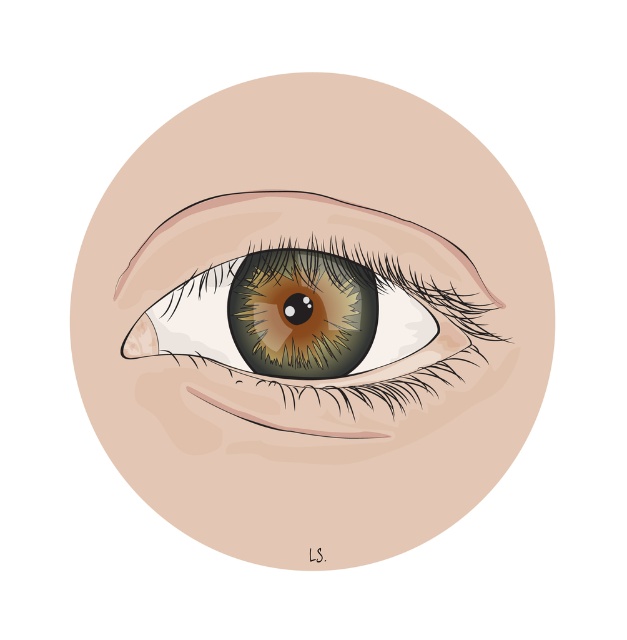
Does brown glossy eye at center have a smaller size compared to brown matte eye at center?

No, brown glossy eye at center is not smaller than brown matte eye at center.

Is brown glossy eye at center to the left of brown matte eye at center from the viewer's perspective?

No, brown glossy eye at center is not to the left of brown matte eye at center.

Identify the location of brown glossy eye at center. [x=312, y=321].